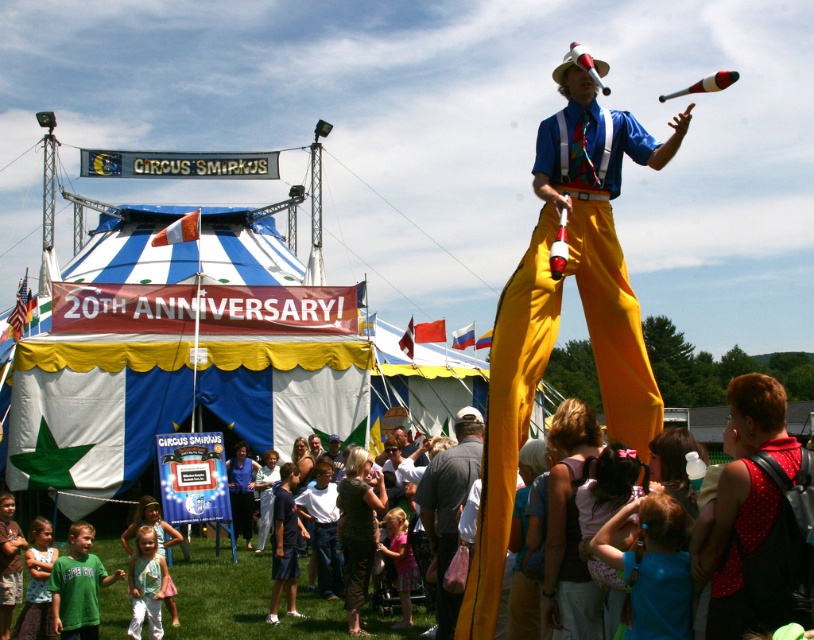
Consider the image. You are standing at the entrance of the Circus Smirkus tent and see two points marked in the image. Which point is closer to you, point (681, 560) or point (139, 630)?

Point (681, 560) is closer to the viewer than point (139, 630).

You are a photographer at the Circus Smirkus event and want to capture a photo of the matte yellow pants at center and the light pink fabric dress at lower center. From the perspective of the photographer standing at the entrance, which object is positioned to the right of the other?

The matte yellow pants at center are to the right of the light pink fabric dress at lower center.

You are a photographer at the circus event and want to capture a photo of both the matte yellow pants at center and the light pink fabric dress at lower center. Which object should you focus on first if you want to ensure both are in frame without moving the camera?

You should focus on the matte yellow pants at center first because its width is larger than the light pink fabric dress at lower center, so centering it will ensure the dress also fits in the frame.